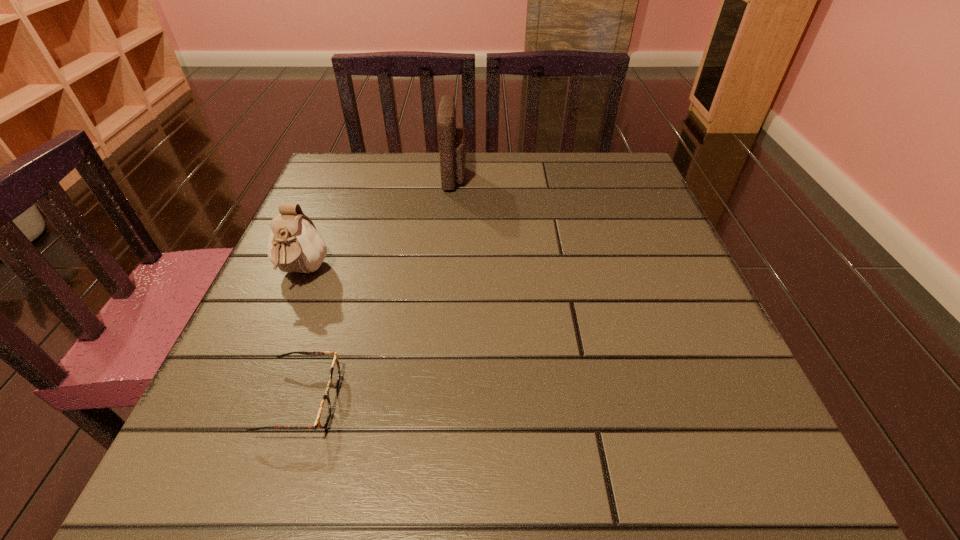
At what (x,y) coordinates should I click in order to perform the action: click on empty location between the right pouch and the second nearest object. Please return your answer as a coordinate pair (x, y). The width and height of the screenshot is (960, 540). Looking at the image, I should click on (379, 225).

Find the location of a particular element. vacant point located between the nearest object and the left pouch is located at coordinates (301, 336).

At what (x,y) coordinates should I click in order to perform the action: click on empty location between the spectacles and the left pouch. Please return your answer as a coordinate pair (x, y). Looking at the image, I should click on (301, 336).

I want to click on vacant space that's between the shorter pouch and the right pouch, so click(x=379, y=225).

Identify the location of free space between the right pouch and the spectacles. (378, 288).

Find the location of a particular element. This screenshot has width=960, height=540. blank region between the shortest object and the rightmost object is located at coordinates (378, 288).

Where is `vacant area that lies between the spectacles and the taller pouch`? Image resolution: width=960 pixels, height=540 pixels. vacant area that lies between the spectacles and the taller pouch is located at coordinates (378, 288).

In order to click on vacant area that lies between the shortest object and the farthest object in this screenshot , I will do `click(378, 288)`.

Locate an element on the screen. vacant area that lies between the spectacles and the left pouch is located at coordinates (301, 336).

Image resolution: width=960 pixels, height=540 pixels. Identify the location of empty space that is in between the taller pouch and the shorter pouch. (379, 225).